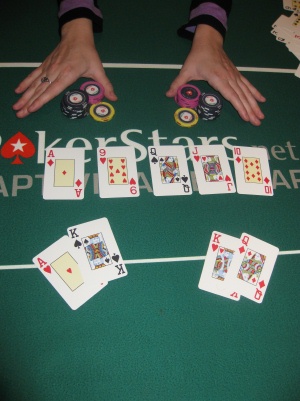
You are a GUI agent. You are given a task and a screenshot of the screen. Output one action in this format:
    pyautogui.click(x=<x>, y=<y>)
    Task: Click on the green table
    This screenshot has width=300, height=401.
    Given the screenshot: What is the action you would take?
    pyautogui.click(x=156, y=19), pyautogui.click(x=121, y=333), pyautogui.click(x=144, y=110)